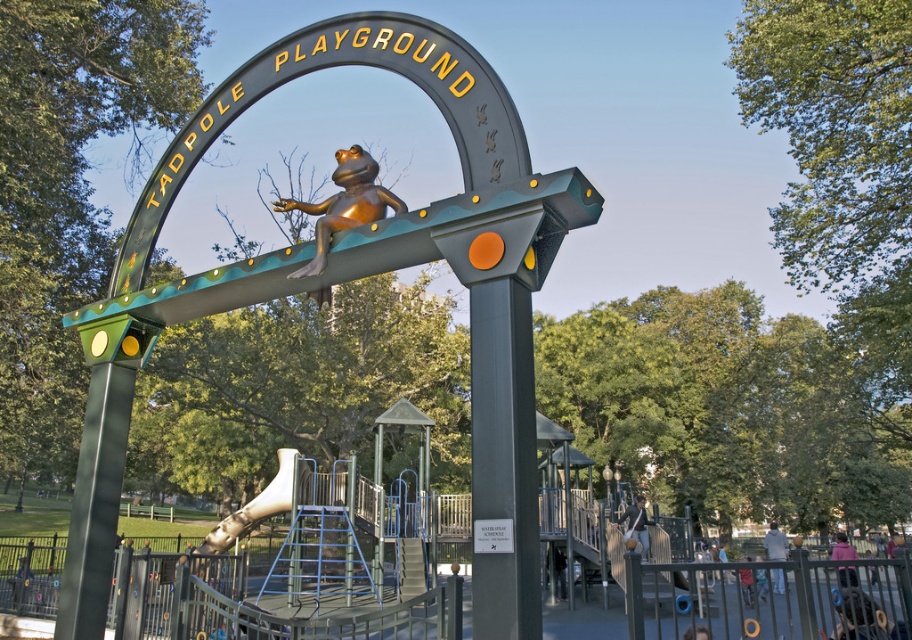
Does bronze shiny frog at center have a greater width compared to metallic silver slide at center?

No.

Does bronze shiny frog at center lie behind metallic silver slide at center?

That is False.

Image resolution: width=912 pixels, height=640 pixels. Find the location of `bronze shiny frog at center`. bronze shiny frog at center is located at coordinates (344, 204).